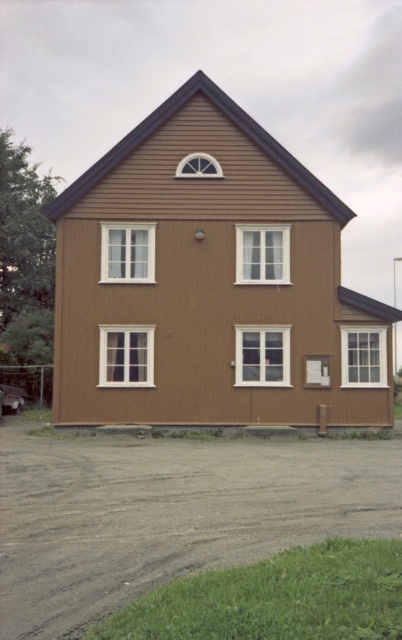
Based on the photo, you are standing at a certain distance from the brown wood house at center. If you want to take a photo of it using a standard camera with a 50mm lens, which requires the subject to be at least 10 feet away to avoid blurriness, are you within the safe distance?

The brown wood house at center and viewer are 82.50 feet apart, so yes, you are within the safe distance since 82.50 feet is greater than the required 10 feet minimum distance.

Consider the image. You are standing at point 0.5, 0.5 in the image. You want to walk to the brown wood house at center. In which direction should you move?

Since you are at point (201, 320) and the brown wood house at center is at point (211, 284), you should move slightly to the left and downward to reach it.